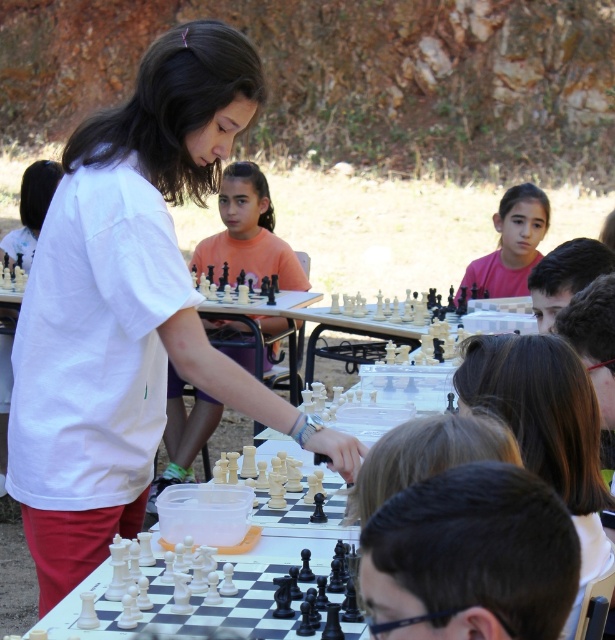
Question: Does white matte shirt at center lie in front of matte white chess set at center?

Choices:
 (A) yes
 (B) no

Answer: (A)

Question: Does matte white chess set at center appear over pink matte shirt at upper center?

Choices:
 (A) yes
 (B) no

Answer: (B)

Question: Estimate the real-world distances between objects in this image. Which object is closer to the pink matte shirt at upper center?

Choices:
 (A) matte white chess set at center
 (B) white matte shirt at center

Answer: (A)

Question: Which object is farther from the camera taking this photo?

Choices:
 (A) pink matte shirt at upper center
 (B) matte white chess set at center
 (C) white matte shirt at center

Answer: (A)

Question: Estimate the real-world distances between objects in this image. Which object is farther from the pink matte shirt at upper center?

Choices:
 (A) matte white chess set at center
 (B) white matte shirt at center

Answer: (B)

Question: Does matte white chess set at center have a smaller size compared to pink matte shirt at upper center?

Choices:
 (A) no
 (B) yes

Answer: (A)